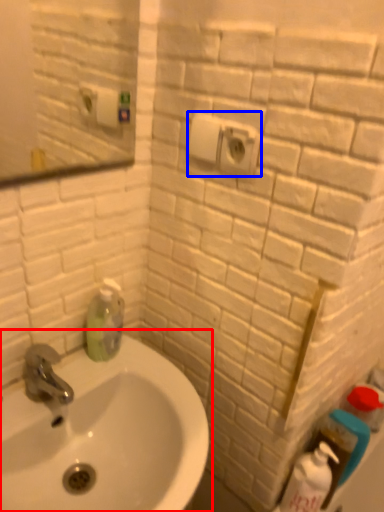
Question: Which object appears closest to the camera in this image, sink (highlighted by a red box) or electric outlet (highlighted by a blue box)?

Choices:
 (A) sink
 (B) electric outlet

Answer: (A)